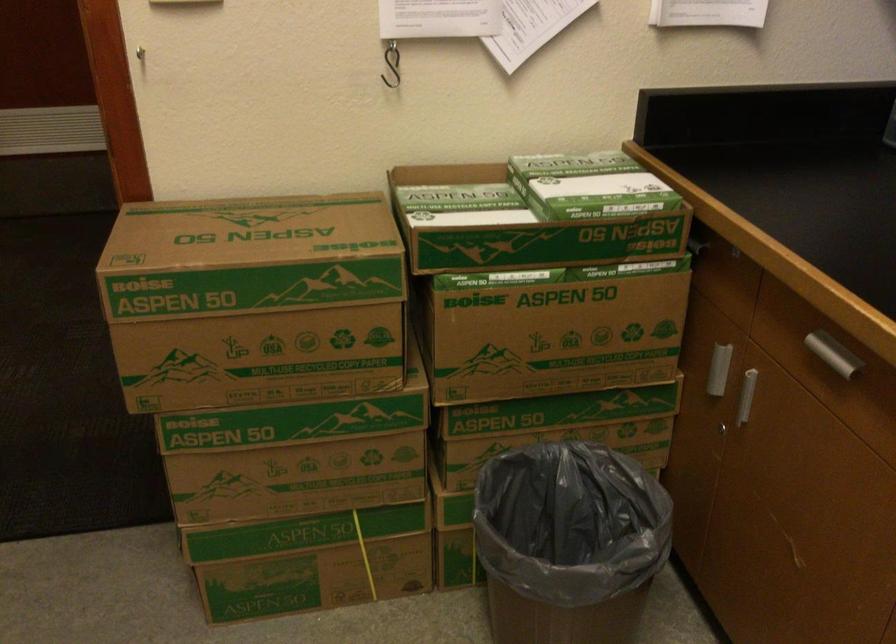
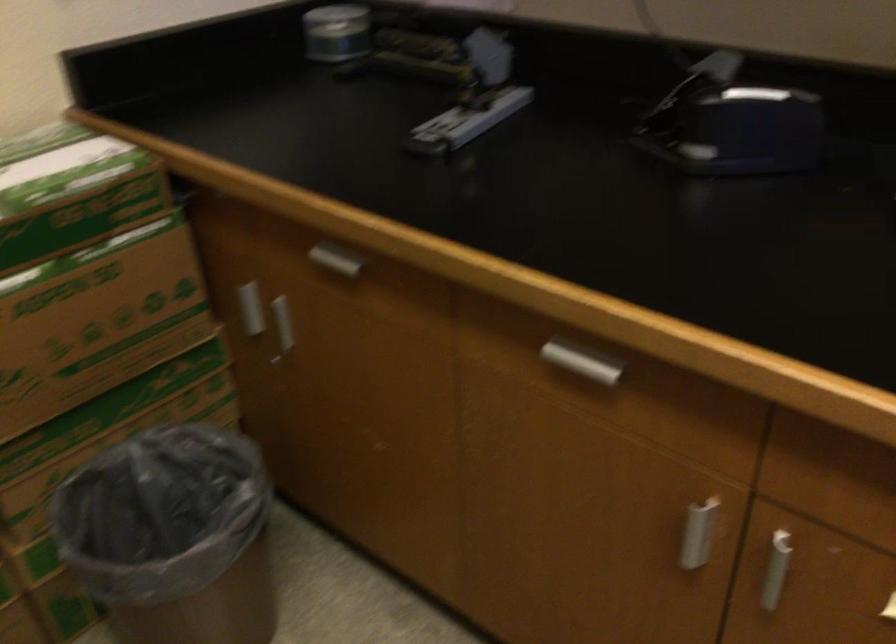
Where in the second image is the point corresponding to (582,315) from the first image?

(99, 301)